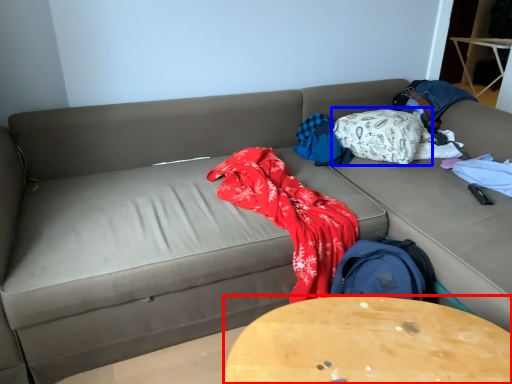
Question: Which point is closer to the camera, table (highlighted by a red box) or blanket (highlighted by a blue box)?

Choices:
 (A) table
 (B) blanket

Answer: (A)